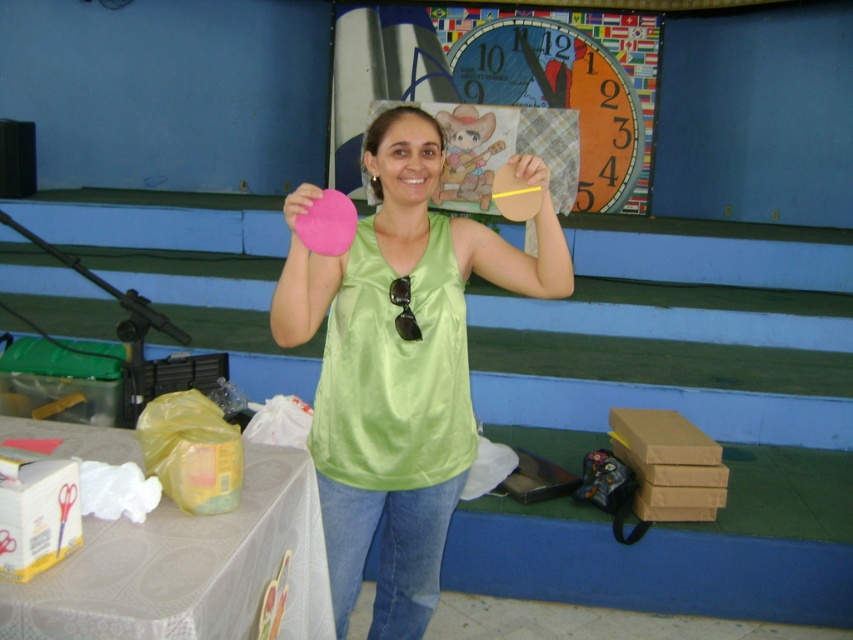
You are organizing a community event and need to place a decorative item on the white plastic table at lower left. However, you notice the matte pink heart at center is currently above it. Can you place the new item on the table without moving the heart?

The matte pink heart at center is located above the white plastic table at lower left, so placing an item on the table might be obstructed by the heart. You should check if there is enough space below the heart to place the new item without interference.

You are at an event and need to place a small gift on the closest surface to you. You see the matte pink heart at center and the white plastic table at lower left. Which surface should you choose?

The white plastic table at lower left is behind the matte pink heart at center, so the matte pink heart at center is closer to you. Place the gift on the matte pink heart at center.